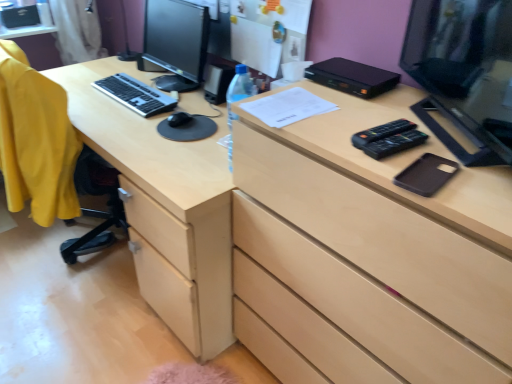
Where is `vacant space behind black matte mouse at center`? This screenshot has height=384, width=512. vacant space behind black matte mouse at center is located at coordinates (183, 100).